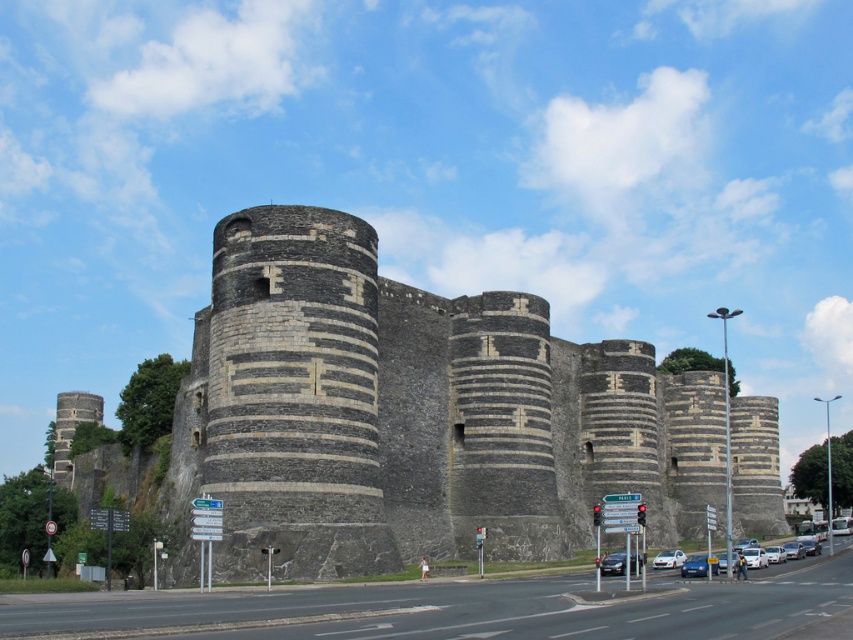
You are standing at the road intersection in front of the gray stone castle at center. You want to take a photo of the castle but your camera can only focus on objects within 50 meters. Will the castle be in focus?

The gray stone castle at center is 55.04 meters from camera, which is beyond the camera focus range of 50 meters. The castle will not be in focus.

You are a tourist standing at the road intersection near the gray stone castle at center and the white glossy sedan at center. You want to take a photo that includes both objects in the frame. Which object should you position closer to the camera to ensure both are visible?

You should position the white glossy sedan at center closer to the camera because the gray stone castle at center is larger in size. This way, both objects will be visible in the frame without one overpowering the other.

You are a delivery driver who needs to park your shiny black sedan at center in a spot that is closest to the castle. Based on the image, where should you position your vehicle relative to the castle?

The shiny black sedan at center is already positioned closest to the castle as it is located at point (613,563), which is the closest possible point to the castle in the image.